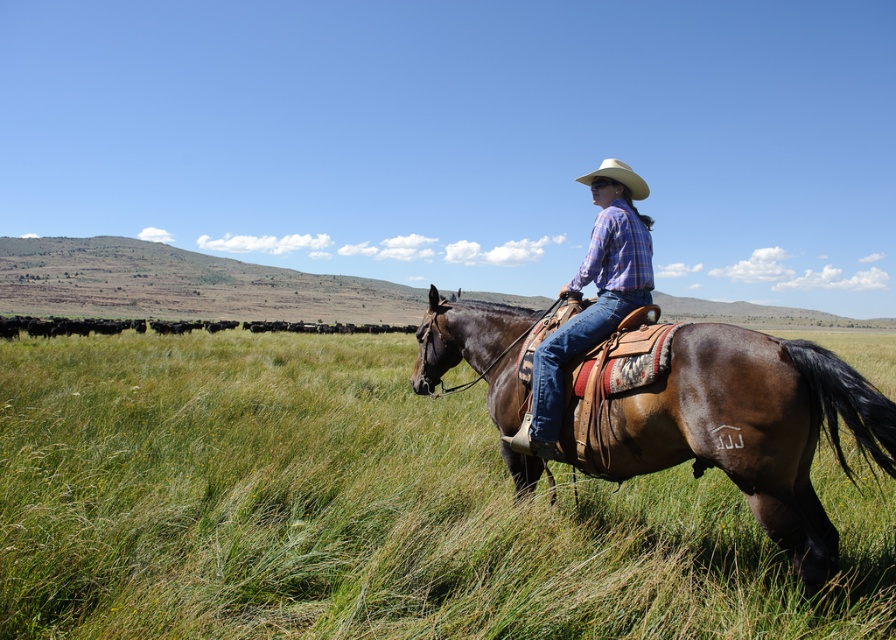
Question: Is green grassy field at center thinner than straw hat at upper center?

Choices:
 (A) no
 (B) yes

Answer: (A)

Question: Considering the real-world distances, which object is farthest from the brown leather saddle at center?

Choices:
 (A) green grassy field at center
 (B) plaid shirt at center

Answer: (A)

Question: Which of the following is the farthest from the observer?

Choices:
 (A) (554, 445)
 (B) (644, 188)
 (C) (828, 388)
 (D) (298, 433)

Answer: (D)

Question: In this image, where is green grassy field at center located relative to plaid shirt at center?

Choices:
 (A) above
 (B) below

Answer: (B)

Question: From the image, what is the correct spatial relationship of brown leather saddle at center in relation to straw hat at upper center?

Choices:
 (A) above
 (B) below

Answer: (B)

Question: Estimate the real-world distances between objects in this image. Which object is farther from the brown leather saddle at center?

Choices:
 (A) straw hat at upper center
 (B) plaid shirt at center
 (C) green grassy field at center

Answer: (C)